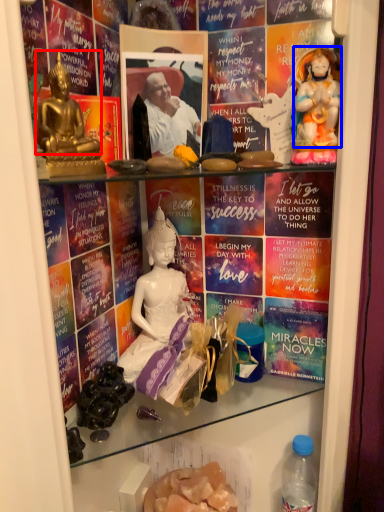
Question: Which object is closer to the camera taking this photo, person (highlighted by a red box) or person (highlighted by a blue box)?

Choices:
 (A) person
 (B) person

Answer: (A)